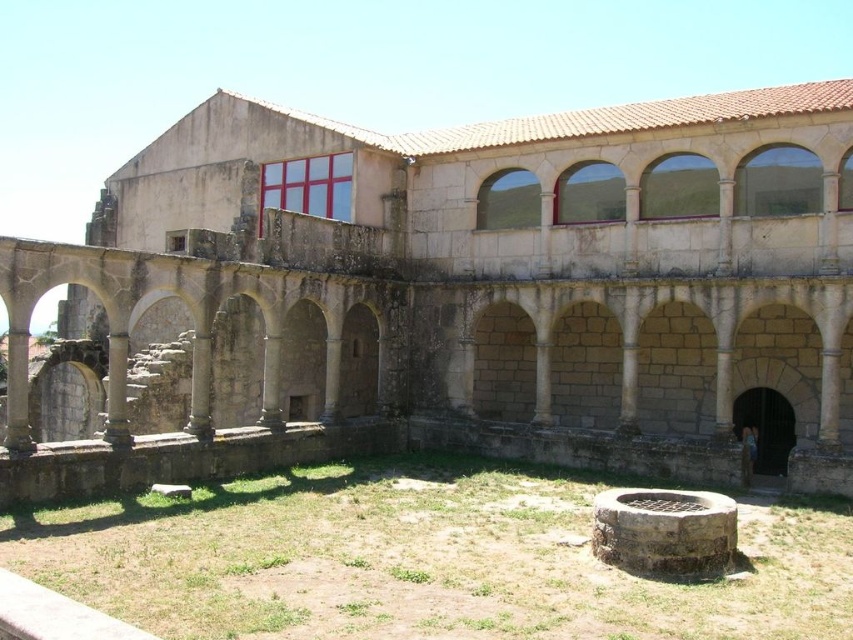
Question: Which object is closer to the camera taking this photo?

Choices:
 (A) brown stone well at center
 (B) stone arches at center

Answer: (A)

Question: Observing the image, what is the correct spatial positioning of stone arches at center in reference to brown stone well at center?

Choices:
 (A) above
 (B) below

Answer: (A)

Question: Can you confirm if stone arches at center is positioned below brown stone well at center?

Choices:
 (A) yes
 (B) no

Answer: (B)

Question: Which object is farther from the camera taking this photo?

Choices:
 (A) brown stone well at center
 (B) stone arches at center

Answer: (B)

Question: Does stone arches at center appear under brown stone well at center?

Choices:
 (A) no
 (B) yes

Answer: (A)